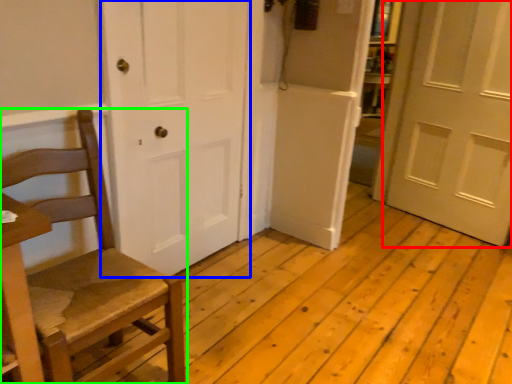
Question: Which object is positioned farthest from door (highlighted by a red box)? Select from door (highlighted by a blue box) and chair (highlighted by a green box).

Choices:
 (A) door
 (B) chair

Answer: (B)